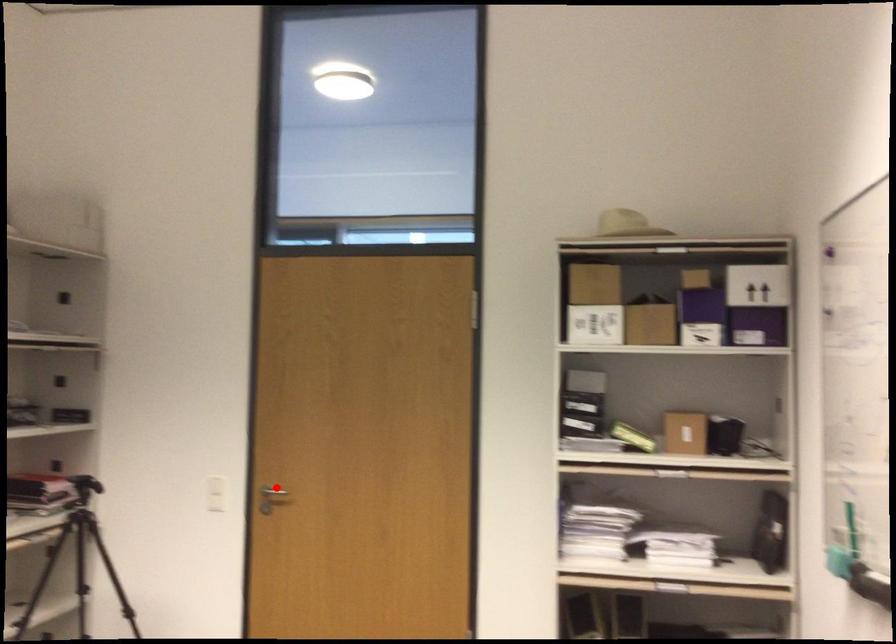
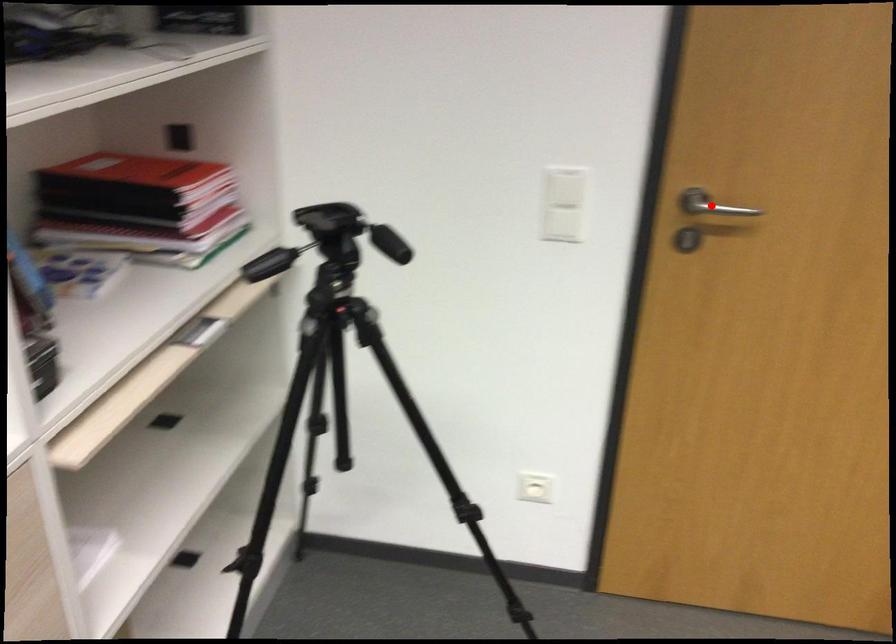
I am providing you with two images of the same scene from different viewpoints. A red point is marked on the first image and another point is marked on the second image. Does the point marked in image1 correspond to the same location as the one in image2?

Yes